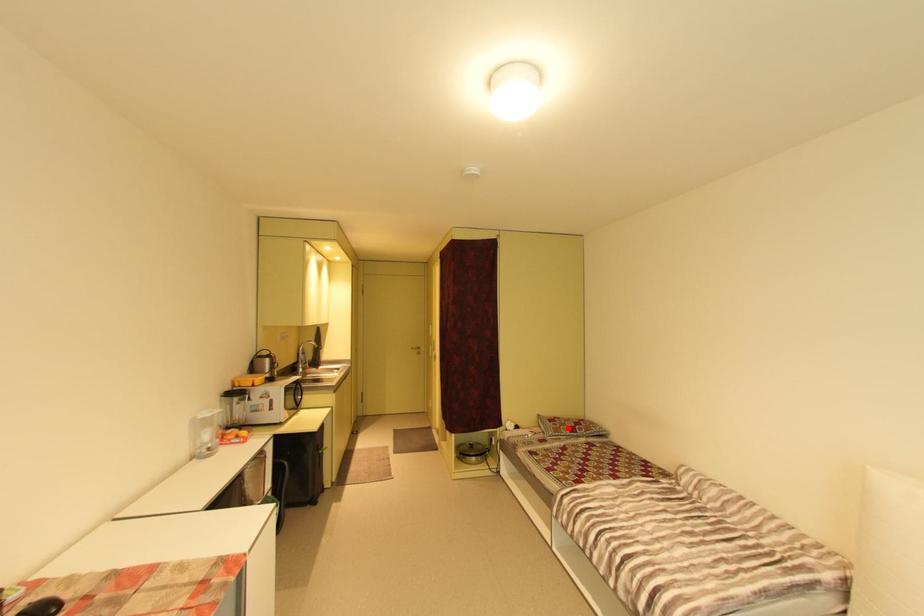
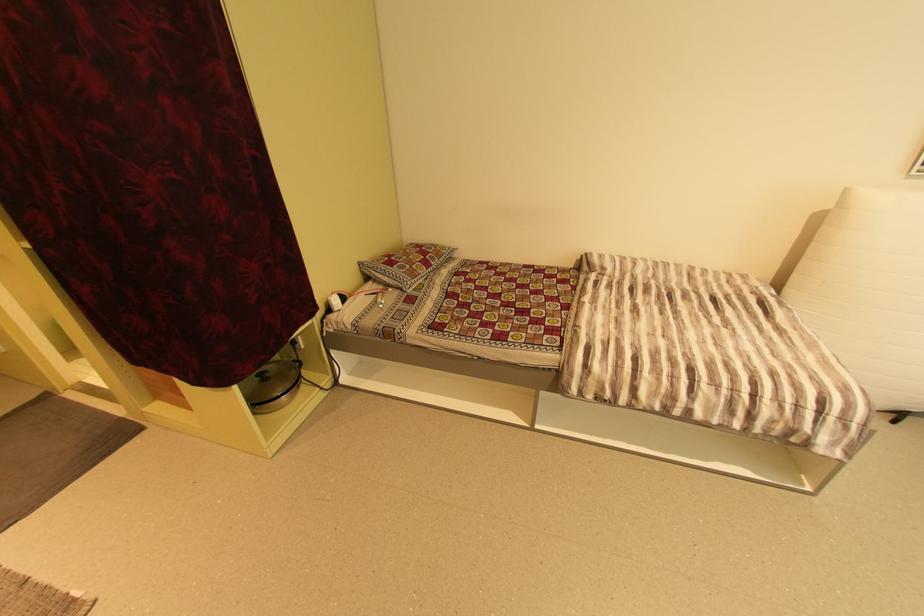
Question: I am providing you with two images of the same scene from different viewpoints. A red point is marked on the first image. At the location where the point appears in image 1, is it still visible in image 2?

Choices:
 (A) Yes
 (B) No

Answer: (A)